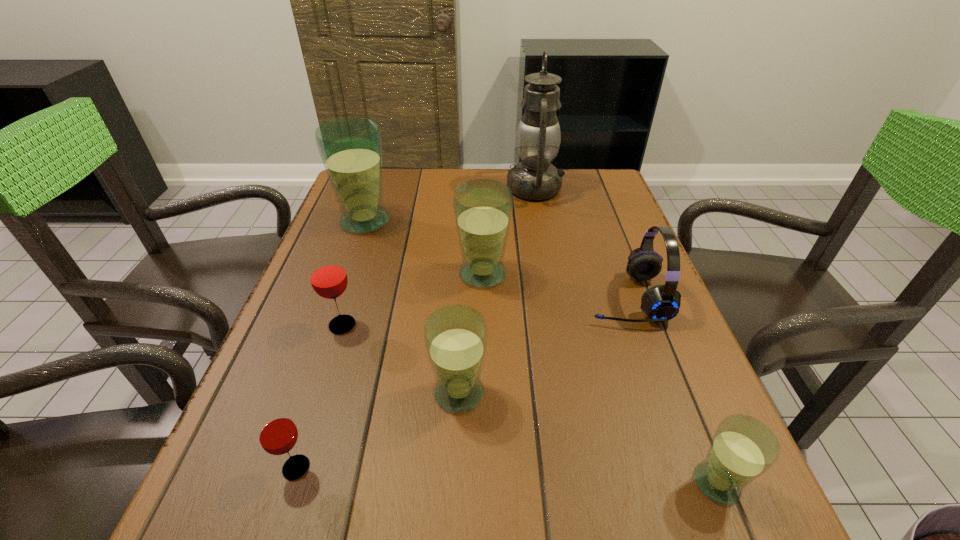
Locate an element on the screen. The width and height of the screenshot is (960, 540). blue glass object that ranks as the closest to the fourth farthest glass is located at coordinates (483, 208).

Locate an element on the screen. the third closest blue glass to the tallest object is located at coordinates point(455,336).

At what (x,y) coordinates should I click in order to perform the action: click on free location that satisfies the following two spatial constraints: 1. on the front side of the smallest blue glass; 2. on the right side of the fourth nearest glass. Please return your answer as a coordinate pair (x, y). Looking at the image, I should click on (292, 483).

The height and width of the screenshot is (540, 960). In order to click on free space in the image that satisfies the following two spatial constraints: 1. on the front side of the sixth farthest object; 2. on the right side of the nearest blue glass in this screenshot , I will do `click(455, 483)`.